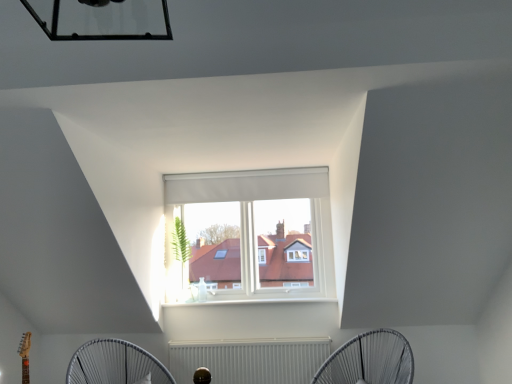
Question: In which direction should I rotate to look at white fabric mechanical fan at lower center, the second mechanical fan when ordered from left to right?

Choices:
 (A) right
 (B) left

Answer: (A)

Question: Does white wireframe fan at lower center, marked as the 1th mechanical fan in a left-to-right arrangement, have a greater height compared to white textured radiator at lower center?

Choices:
 (A) yes
 (B) no

Answer: (A)

Question: From the image's perspective, would you say white wireframe fan at lower center, marked as the 1th mechanical fan in a left-to-right arrangement, is shown under white textured radiator at lower center?

Choices:
 (A) yes
 (B) no

Answer: (B)

Question: Considering the relative sizes of white wireframe fan at lower center, marked as the 1th mechanical fan in a left-to-right arrangement, and white textured radiator at lower center in the image provided, is white wireframe fan at lower center, marked as the 1th mechanical fan in a left-to-right arrangement, bigger than white textured radiator at lower center?

Choices:
 (A) yes
 (B) no

Answer: (A)

Question: Are white wireframe fan at lower center, marked as the 1th mechanical fan in a left-to-right arrangement, and white textured radiator at lower center located far from each other?

Choices:
 (A) no
 (B) yes

Answer: (A)

Question: Is white wireframe fan at lower center, marked as the 1th mechanical fan in a left-to-right arrangement, at the right side of white textured radiator at lower center?

Choices:
 (A) yes
 (B) no

Answer: (B)

Question: Is white wireframe fan at lower center, the second mechanical fan from the right, facing away from white textured radiator at lower center?

Choices:
 (A) yes
 (B) no

Answer: (B)

Question: From the image's perspective, is white wireframe fan at lower center, marked as the 1th mechanical fan in a left-to-right arrangement, located above white fabric mechanical fan at lower center, the second mechanical fan when ordered from left to right?

Choices:
 (A) yes
 (B) no

Answer: (B)

Question: Can you confirm if white wireframe fan at lower center, the second mechanical fan from the right, is positioned to the right of white fabric mechanical fan at lower center, the first mechanical fan from the right?

Choices:
 (A) yes
 (B) no

Answer: (B)

Question: Is the position of white wireframe fan at lower center, marked as the 1th mechanical fan in a left-to-right arrangement, less distant than that of white fabric mechanical fan at lower center, the second mechanical fan when ordered from left to right?

Choices:
 (A) no
 (B) yes

Answer: (A)

Question: Considering the relative sizes of white wireframe fan at lower center, the second mechanical fan from the right, and white fabric mechanical fan at lower center, the second mechanical fan when ordered from left to right, in the image provided, is white wireframe fan at lower center, the second mechanical fan from the right, taller than white fabric mechanical fan at lower center, the second mechanical fan when ordered from left to right,?

Choices:
 (A) yes
 (B) no

Answer: (B)

Question: Considering the relative sizes of white wireframe fan at lower center, the second mechanical fan from the right, and white fabric mechanical fan at lower center, the second mechanical fan when ordered from left to right, in the image provided, is white wireframe fan at lower center, the second mechanical fan from the right, thinner than white fabric mechanical fan at lower center, the second mechanical fan when ordered from left to right,?

Choices:
 (A) yes
 (B) no

Answer: (A)

Question: Is white wireframe fan at lower center, marked as the 1th mechanical fan in a left-to-right arrangement, oriented away from white fabric mechanical fan at lower center, the second mechanical fan when ordered from left to right?

Choices:
 (A) no
 (B) yes

Answer: (A)

Question: Can you confirm if white fabric mechanical fan at lower center, the first mechanical fan from the right, is positioned to the right of white textured radiator at lower center?

Choices:
 (A) no
 (B) yes

Answer: (B)